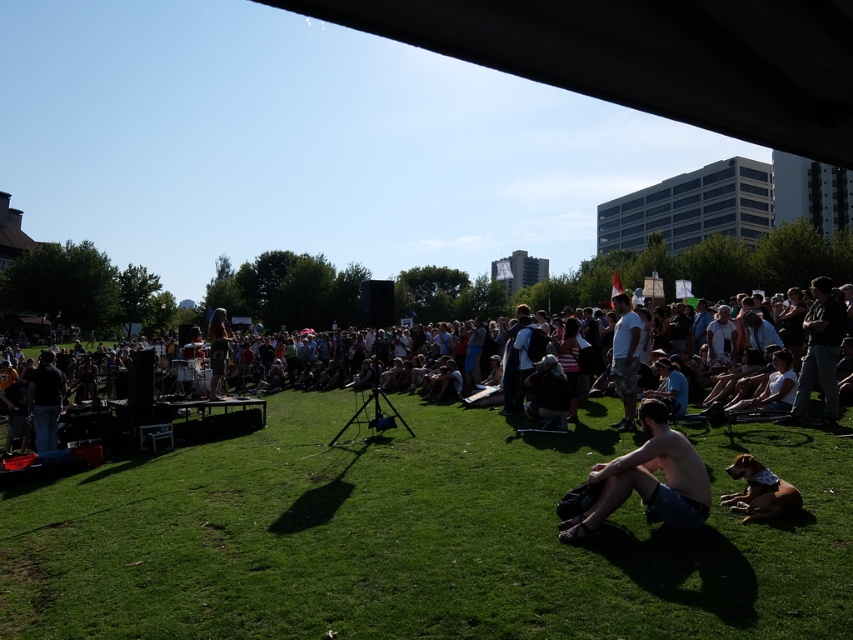
You are standing at the center of the grassy field and see the dark gray jeans at center and the dark gray backpack at center. If you want to pick up the backpack without moving from your current position, is the backpack within your reach? Assume your maximum reach is 15 feet.

The dark gray jeans at center is 16.50 feet away from dark gray backpack at center. Since your maximum reach is 15 feet, the backpack is out of reach from your current position.

Based on the photo, you are standing at the edge of the grassy field and see the dark gray shirt at left and the dark gray backpack at center. Which object is shorter in height?

The dark gray shirt at left is shorter in height compared to the dark gray backpack at center.